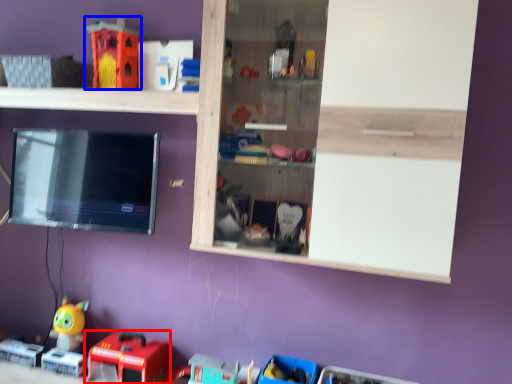
Question: Which of the following is the farthest to the observer, toy (highlighted by a red box) or toy (highlighted by a blue box)?

Choices:
 (A) toy
 (B) toy

Answer: (B)